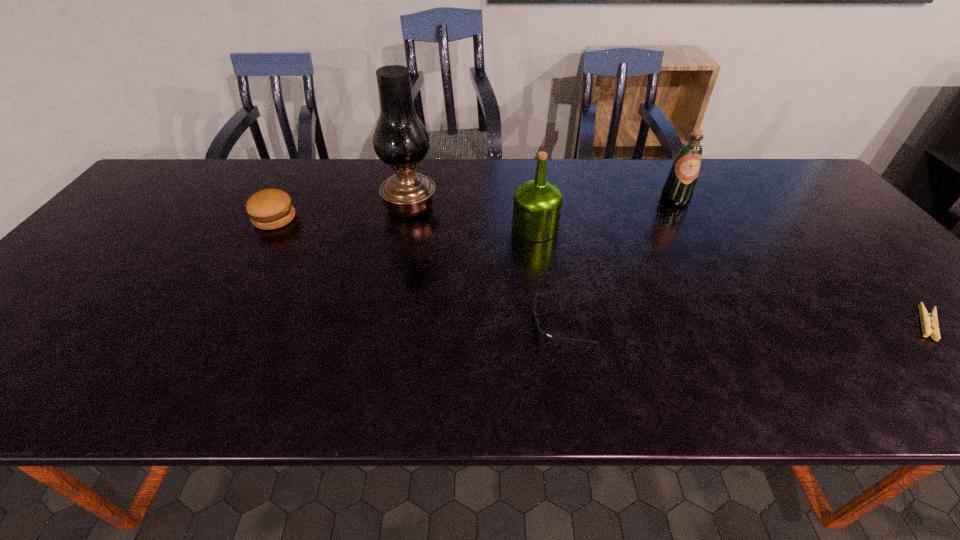
The image size is (960, 540). I want to click on vacant area at the right edge of the desktop, so click(x=851, y=260).

In the image, there is a desktop. Where is `free space at the far left corner`? The image size is (960, 540). free space at the far left corner is located at coordinates tap(172, 165).

Where is `free point between the sunglasses and the nearer olive oil`? free point between the sunglasses and the nearer olive oil is located at coordinates (548, 275).

Find the location of a particular element. The height and width of the screenshot is (540, 960). free space between the fifth tallest object and the fourth tallest object is located at coordinates (419, 271).

Locate an element on the screen. unoccupied position between the leftmost object and the fifth tallest object is located at coordinates (419, 271).

The width and height of the screenshot is (960, 540). Find the location of `vacant area that lies between the left olive oil and the second object from left to right`. vacant area that lies between the left olive oil and the second object from left to right is located at coordinates (472, 218).

At what (x,y) coordinates should I click in order to perform the action: click on free spot between the fourth tallest object and the fifth object from right to left. Please return your answer as a coordinate pair (x, y). This screenshot has width=960, height=540. Looking at the image, I should click on (343, 213).

This screenshot has height=540, width=960. Find the location of `blank region between the sunglasses and the right olive oil`. blank region between the sunglasses and the right olive oil is located at coordinates (618, 261).

Choose which object is the third nearest neighbor to the oil lamp. Please provide its 2D coordinates. Your answer should be formatted as a tuple, i.e. [(x, y)], where the tuple contains the x and y coordinates of a point satisfying the conditions above.

[(539, 331)]

Select which object appears as the closest to the third shortest object. Please provide its 2D coordinates. Your answer should be formatted as a tuple, i.e. [(x, y)], where the tuple contains the x and y coordinates of a point satisfying the conditions above.

[(400, 139)]